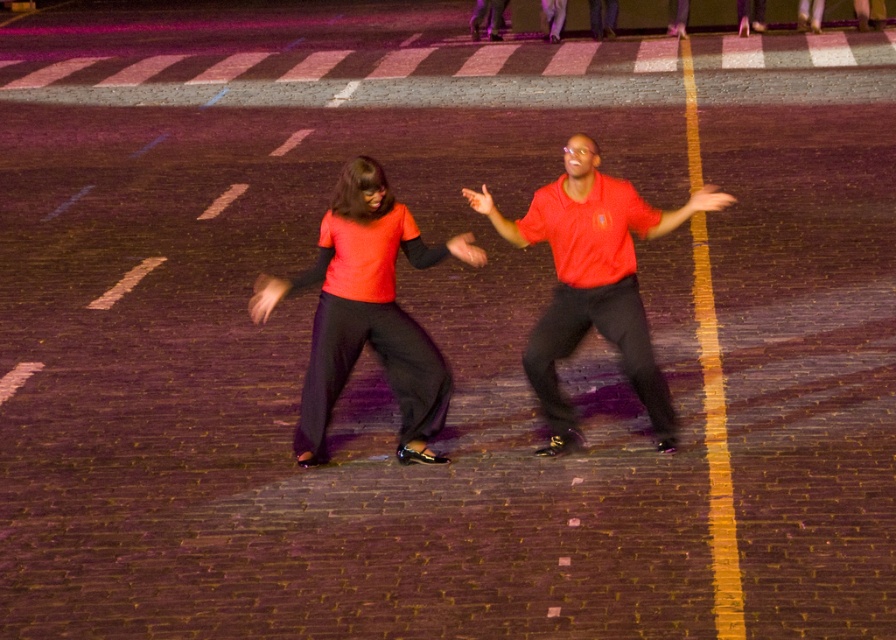
Question: Which of the following is the farthest from the observer?

Choices:
 (A) matte orange shirt at center
 (B) matte red shirt at center

Answer: (B)

Question: Is the position of matte orange shirt at center less distant than that of matte red shirt at center?

Choices:
 (A) yes
 (B) no

Answer: (A)

Question: Is matte orange shirt at center smaller than matte red shirt at center?

Choices:
 (A) yes
 (B) no

Answer: (B)

Question: Which object appears farthest from the camera in this image?

Choices:
 (A) matte orange shirt at center
 (B) matte red shirt at center

Answer: (B)

Question: Does matte orange shirt at center lie in front of matte red shirt at center?

Choices:
 (A) yes
 (B) no

Answer: (A)

Question: Which point is farther from the camera taking this photo?

Choices:
 (A) (579, 260)
 (B) (470, 256)

Answer: (A)